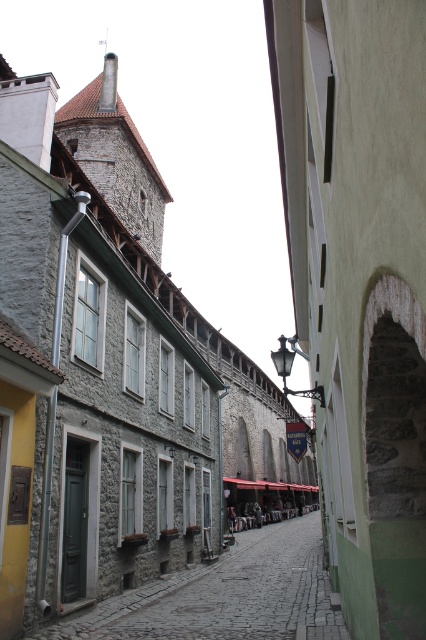
Is point (397, 49) positioned before point (322, 628)?

Yes, it is.

Between smooth stone arch at center and stone paved alley at center, which one is positioned higher?

smooth stone arch at center

Is point (370, 0) less distant than point (267, 593)?

Yes, it is in front of point (267, 593).

Locate an element on the screen. This screenshot has width=426, height=640. smooth stone arch at center is located at coordinates (359, 284).